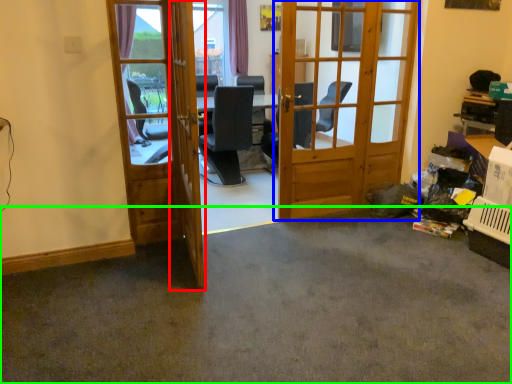
Question: Considering the real-world distances, which object is closest to screen door (highlighted by a red box)? door (highlighted by a blue box) or concrete (highlighted by a green box).

Choices:
 (A) door
 (B) concrete

Answer: (B)